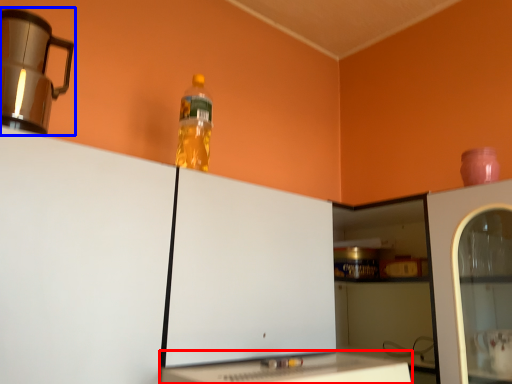
Question: Which object appears closest to the camera in this image, table (highlighted by a red box) or home appliance (highlighted by a blue box)?

Choices:
 (A) table
 (B) home appliance

Answer: (A)